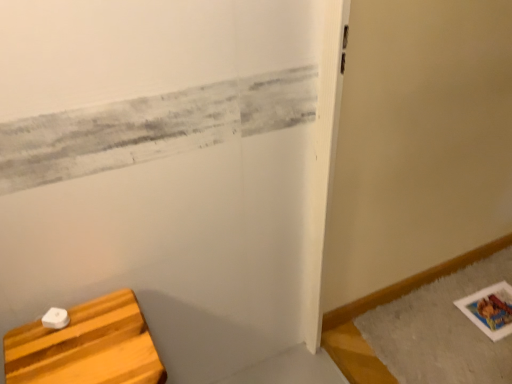
I want to click on free location above gray fluffy bath mat at lower right (from a real-world perspective), so click(458, 322).